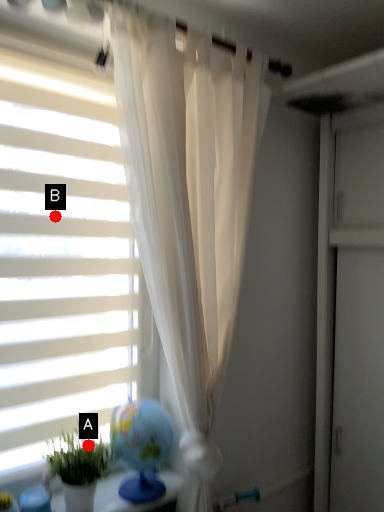
Question: Two points are circled on the image, labeled by A and B beside each circle. Which point is farther from the camera taking this photo?

Choices:
 (A) A is further
 (B) B is further

Answer: (B)